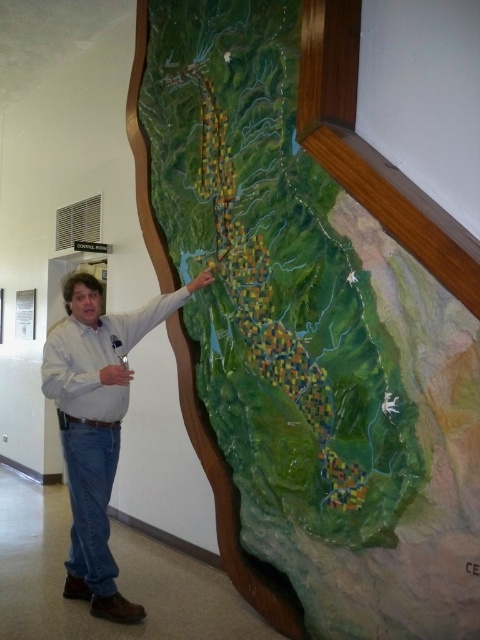
Question: Which object is closer to the camera taking this photo?

Choices:
 (A) green textured map at center
 (B) denim jeans at center

Answer: (A)

Question: Is the position of green textured map at center less distant than that of denim jeans at center?

Choices:
 (A) no
 (B) yes

Answer: (B)

Question: Which of the following is the farthest from the observer?

Choices:
 (A) (96, 609)
 (B) (362, 342)

Answer: (A)

Question: From the image, what is the correct spatial relationship of green textured map at center in relation to denim jeans at center?

Choices:
 (A) above
 (B) below

Answer: (A)

Question: Which object is closer to the camera taking this photo?

Choices:
 (A) green textured map at center
 (B) denim jeans at center

Answer: (A)

Question: Can you confirm if green textured map at center is positioned below denim jeans at center?

Choices:
 (A) yes
 (B) no

Answer: (B)